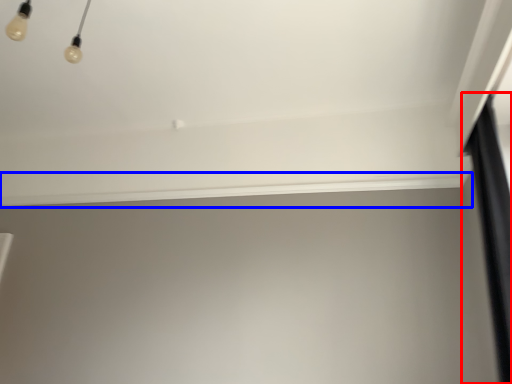
Question: Which object is further to the camera taking this photo, curtain (highlighted by a red box) or window sill (highlighted by a blue box)?

Choices:
 (A) curtain
 (B) window sill

Answer: (B)